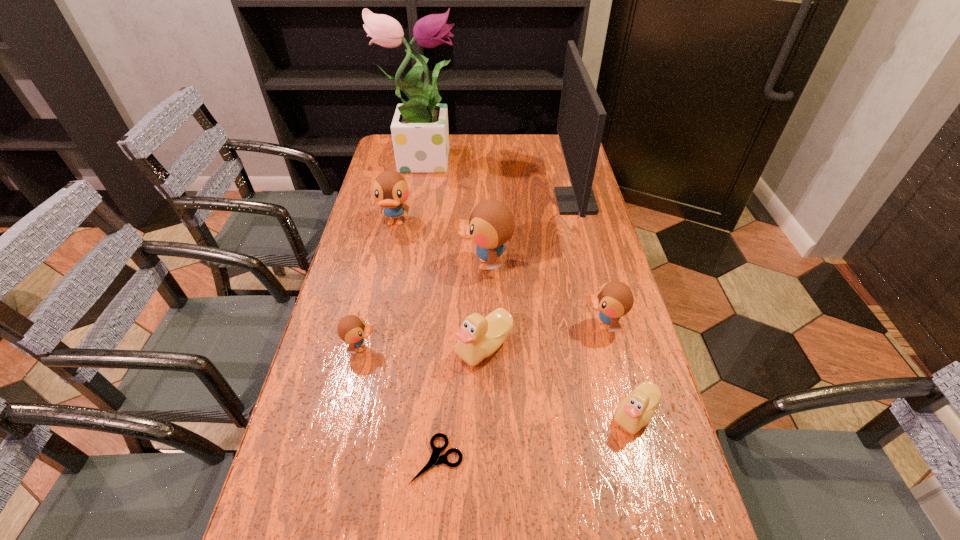
Find the location of a particular element. vacant area located on the front-facing side of the tallest duck is located at coordinates [425, 264].

Find the location of `vacant space located 0.260m on the front-facing side of the farthest blue duck`. vacant space located 0.260m on the front-facing side of the farthest blue duck is located at coordinates (379, 298).

Where is `vacant space situated on the front-facing side of the second smallest blue duck`? The width and height of the screenshot is (960, 540). vacant space situated on the front-facing side of the second smallest blue duck is located at coordinates (546, 325).

Find the location of a particular element. The image size is (960, 540). free location located 0.400m on the front-facing side of the second smallest blue duck is located at coordinates (426, 325).

Identify the location of vacant space located 0.340m on the front-facing side of the second smallest blue duck. (449, 325).

Where is `free location located 0.280m at the beak of the bigger beige duck`? The width and height of the screenshot is (960, 540). free location located 0.280m at the beak of the bigger beige duck is located at coordinates (343, 347).

Find the location of `vacant area situated 0.280m at the beak of the bigger beige duck`. vacant area situated 0.280m at the beak of the bigger beige duck is located at coordinates (343, 347).

Locate an element on the screen. Image resolution: width=960 pixels, height=540 pixels. free space located 0.290m at the beak of the bigger beige duck is located at coordinates (338, 347).

At what (x,y) coordinates should I click in order to perform the action: click on vacant space situated 0.120m on the front-facing side of the smallest blue duck. Please return your answer as a coordinate pair (x, y). This screenshot has height=540, width=960. Looking at the image, I should click on (426, 348).

Locate an element on the screen. This screenshot has width=960, height=540. vacant area situated at the beak of the nearest duck is located at coordinates (464, 414).